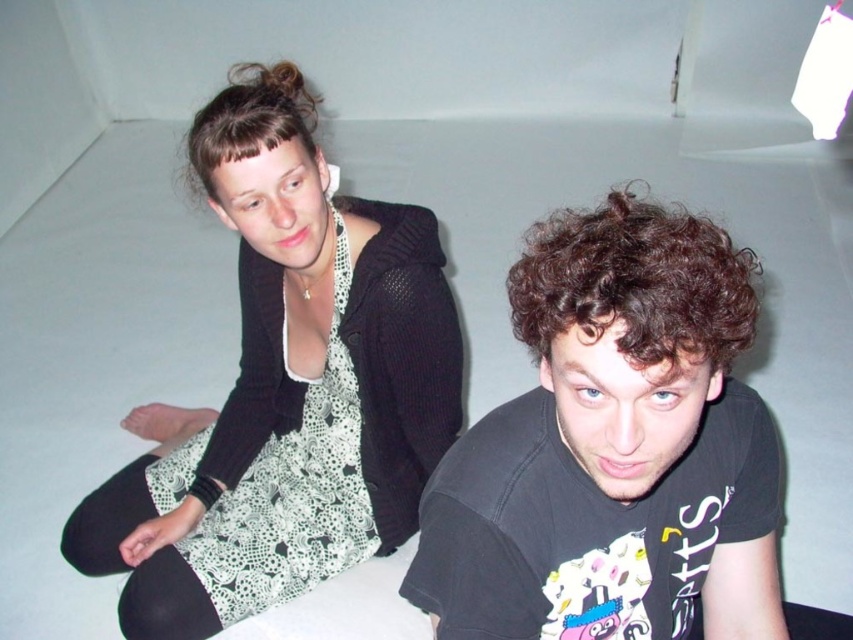
What do you see at coordinates (613, 449) in the screenshot? The image size is (853, 640). I see `black matte t-shirt at center` at bounding box center [613, 449].

In the scene shown: Is black matte t-shirt at center to the left of white crochet dress at center from the viewer's perspective?

No, black matte t-shirt at center is not to the left of white crochet dress at center.

Does point (566, 230) come closer to viewer compared to point (432, 326)?

That is True.

The width and height of the screenshot is (853, 640). I want to click on black matte t-shirt at center, so click(x=613, y=449).